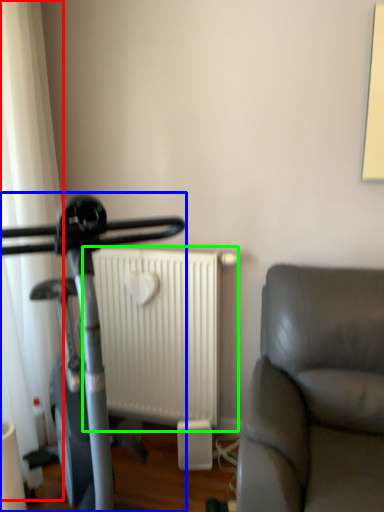
Question: Which object is the closest to the curtain (highlighted by a red box)? Choose among these: stationary bicycle (highlighted by a blue box) or radiator (highlighted by a green box).

Choices:
 (A) stationary bicycle
 (B) radiator

Answer: (A)